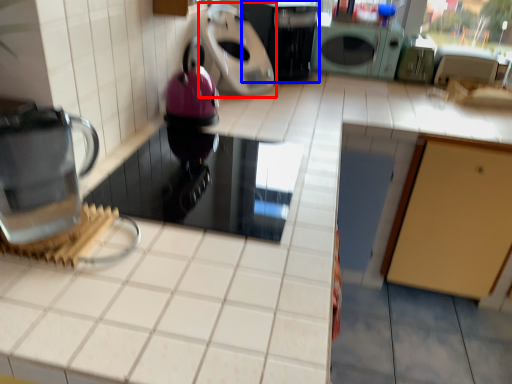
Question: Among these objects, which one is farthest to the camera, kitchen appliance (highlighted by a red box) or kitchen appliance (highlighted by a blue box)?

Choices:
 (A) kitchen appliance
 (B) kitchen appliance

Answer: (B)